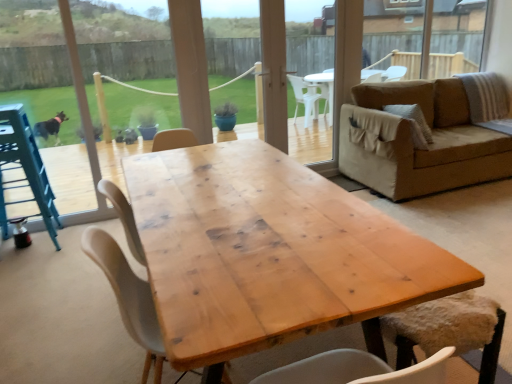
Question: From the image's perspective, is white matte chair at center, the first chair in the left-to-right sequence, on top of natural wood table at center?

Choices:
 (A) yes
 (B) no

Answer: (B)

Question: Considering the relative sizes of white matte chair at center, which is the second chair in right-to-left order, and natural wood table at center in the image provided, is white matte chair at center, which is the second chair in right-to-left order, taller than natural wood table at center?

Choices:
 (A) yes
 (B) no

Answer: (A)

Question: Does white matte chair at center, which is the second chair in right-to-left order, turn towards natural wood table at center?

Choices:
 (A) yes
 (B) no

Answer: (A)

Question: Are white matte chair at center, which is the second chair in right-to-left order, and natural wood table at center located far from each other?

Choices:
 (A) yes
 (B) no

Answer: (B)

Question: Can you confirm if white matte chair at center, the first chair in the left-to-right sequence, is thinner than natural wood table at center?

Choices:
 (A) no
 (B) yes

Answer: (B)

Question: Is metallic blue feeding chair at left in front of or behind natural wood table at center in the image?

Choices:
 (A) behind
 (B) front

Answer: (A)

Question: From the image's perspective, relative to natural wood table at center, is metallic blue feeding chair at left above or below?

Choices:
 (A) above
 (B) below

Answer: (A)

Question: Considering the positions of metallic blue feeding chair at left and natural wood table at center in the image, is metallic blue feeding chair at left wider or thinner than natural wood table at center?

Choices:
 (A) thin
 (B) wide

Answer: (A)

Question: From a real-world perspective, is metallic blue feeding chair at left physically located above or below natural wood table at center?

Choices:
 (A) above
 (B) below

Answer: (A)

Question: Based on their sizes in the image, would you say natural wood table at center is bigger or smaller than metallic blue feeding chair at left?

Choices:
 (A) small
 (B) big

Answer: (B)

Question: In terms of height, does natural wood table at center look taller or shorter compared to metallic blue feeding chair at left?

Choices:
 (A) tall
 (B) short

Answer: (B)

Question: Considering the positions of point (218, 297) and point (2, 152), is point (218, 297) closer or farther from the camera than point (2, 152)?

Choices:
 (A) closer
 (B) farther

Answer: (A)

Question: From a real-world perspective, is natural wood table at center above or below metallic blue feeding chair at left?

Choices:
 (A) above
 (B) below

Answer: (B)

Question: Is point (316, 165) positioned closer to the camera than point (44, 210)?

Choices:
 (A) closer
 (B) farther

Answer: (B)

Question: Is transparent plastic screen door at center spatially inside metallic blue feeding chair at left, or outside of it?

Choices:
 (A) inside
 (B) outside

Answer: (B)